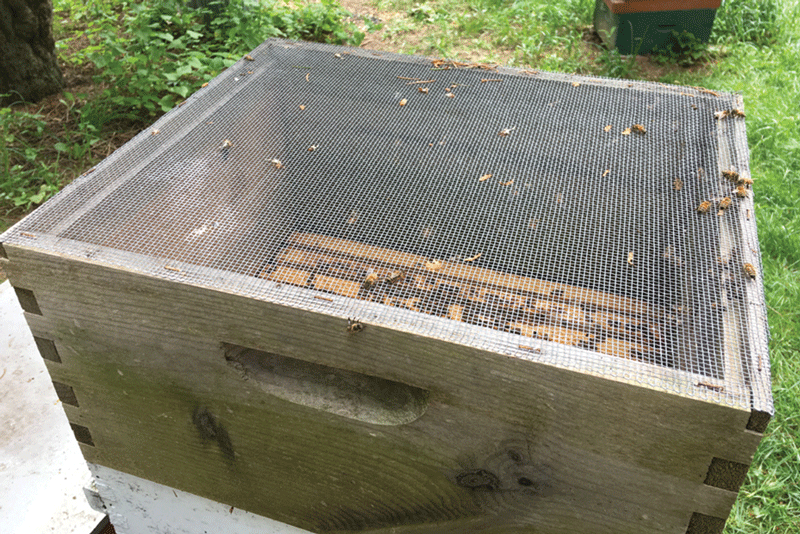
I want to click on inside corners, so click(x=708, y=135), click(x=286, y=119).